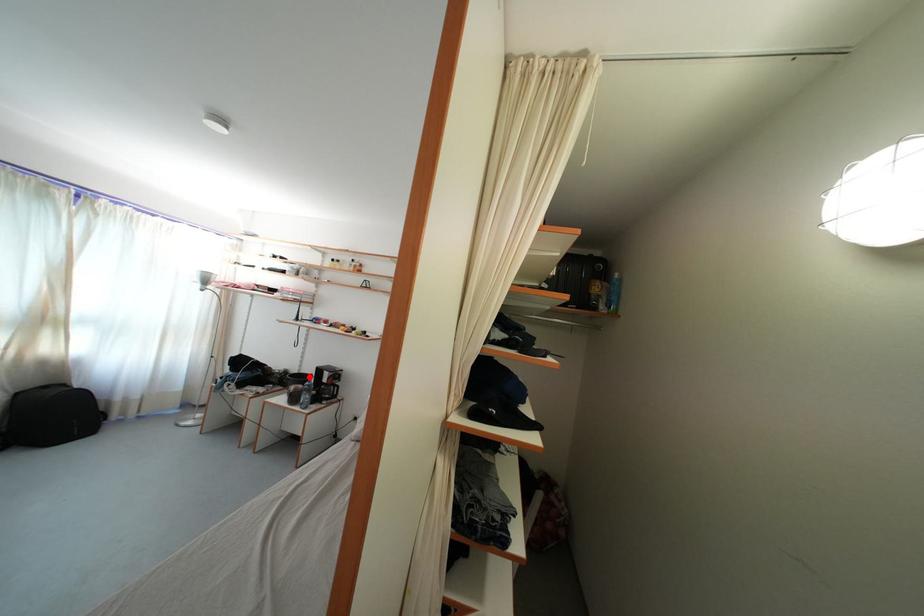
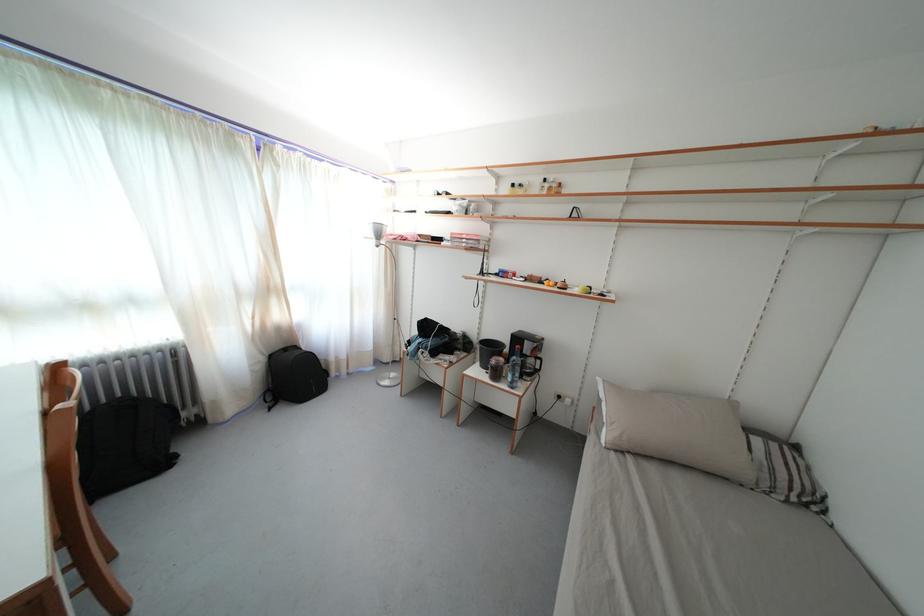
Find the pixel in the second image that matches the highlighted location in the first image.

(491, 341)